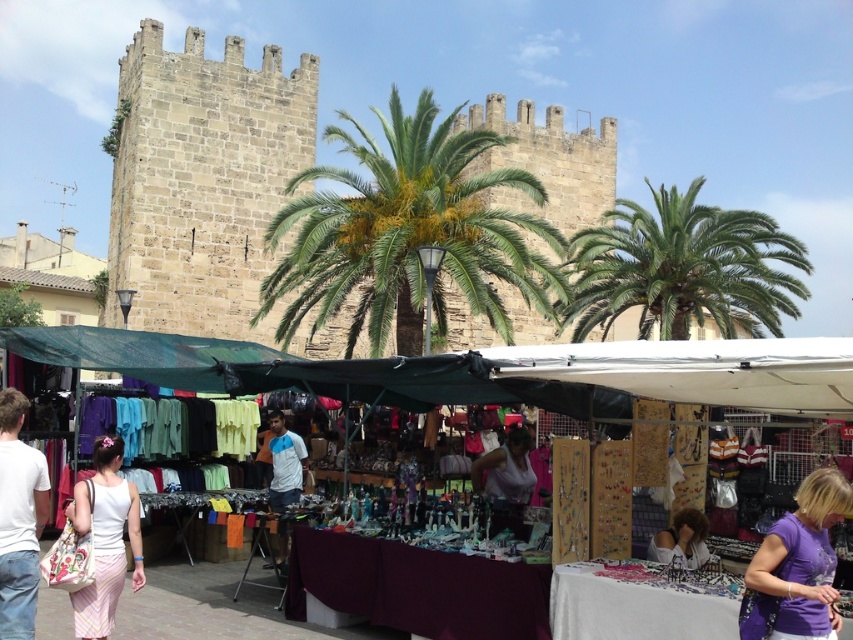
You are standing at the point labeled as point [808,582] in the image. The historic stone tower is 37.67 meters away from you. If you walk straight towards the tower, will you pass through any of the market stalls under the temporary canopies?

The distance between you and the historic stone tower is 37.67 meters. Since the market stalls are located in the foreground, you would pass through them on your way to the tower. Therefore, yes, you will pass through the market stalls under the temporary canopies while walking towards the tower.

You are a customer at the market and want to buy both the purple cotton shirt at lower right and the white cotton shirt at lower left. If you are standing between them, can you comfortably reach both shirts at the same time with your arms fully extended? Assume your arm span is 6 feet.

The purple cotton shirt at lower right and white cotton shirt at lower left are 113.80 feet apart from each other. Since your arm span is only 6 feet, you cannot comfortably reach both shirts at the same time.